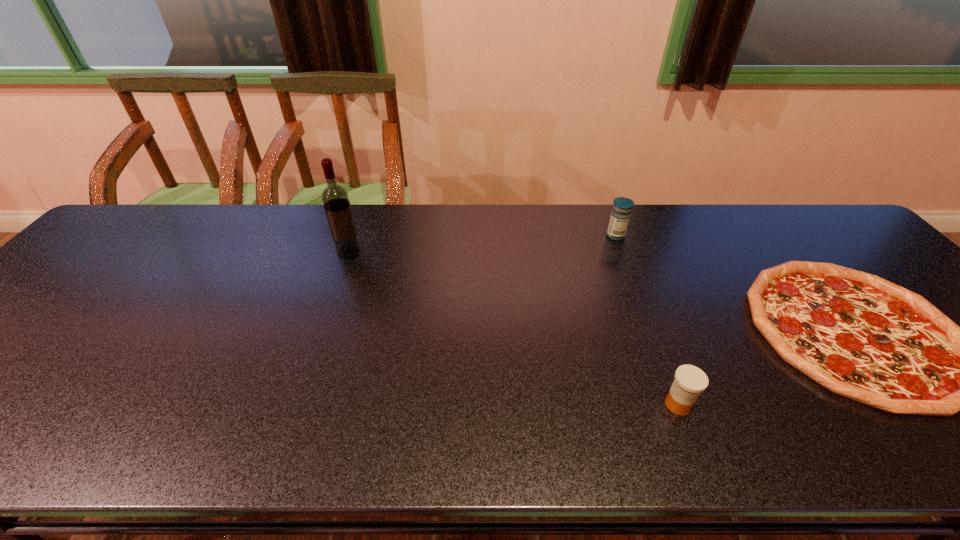
I want to click on free spot located 0.300m on the label of the shorter medicine, so click(516, 404).

The height and width of the screenshot is (540, 960). Identify the location of wine bottle present at the far edge. (335, 198).

Find the location of a particular element. This screenshot has height=540, width=960. medicine that is at the far edge is located at coordinates (620, 215).

I want to click on object that is at the near edge, so click(x=690, y=381).

In the image, there is a desktop. Where is `blank space at the far edge`? Image resolution: width=960 pixels, height=540 pixels. blank space at the far edge is located at coordinates (482, 223).

This screenshot has height=540, width=960. In the image, there is a desktop. In order to click on vacant area at the near edge in this screenshot , I will do `click(742, 441)`.

The width and height of the screenshot is (960, 540). In the image, there is a desktop. Identify the location of vacant space at the left edge. (79, 264).

The width and height of the screenshot is (960, 540). Find the location of `vacant area at the far left corner`. vacant area at the far left corner is located at coordinates (143, 242).

Image resolution: width=960 pixels, height=540 pixels. Identify the location of vacant space at the far right corner of the desktop. (828, 219).

Identify the location of vacant space in between the second tallest object and the leftmost object. The width and height of the screenshot is (960, 540). (482, 244).